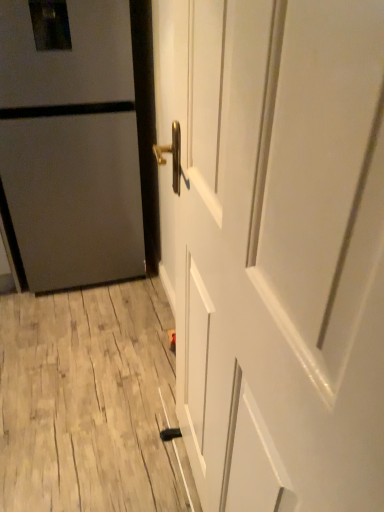
Question: From a real-world perspective, is white glossy door at center, marked as the second door in a left-to-right arrangement, physically located above or below matte gray door at left, arranged as the 2th door when viewed from the right?

Choices:
 (A) below
 (B) above

Answer: (B)

Question: Based on their sizes in the image, would you say white glossy door at center, which ranks as the first door in front-to-back order, is bigger or smaller than matte gray door at left, arranged as the 2th door when viewed from the right?

Choices:
 (A) small
 (B) big

Answer: (A)

Question: Based on their positions, is white glossy door at center, which ranks as the first door in front-to-back order, located to the left or right of matte gray door at left, marked as the 1th door in a back-to-front arrangement?

Choices:
 (A) right
 (B) left

Answer: (A)

Question: Considering the positions of matte gray door at left, which appears as the second door when viewed from the front, and white glossy door at center, marked as the second door in a left-to-right arrangement, in the image, is matte gray door at left, which appears as the second door when viewed from the front, wider or thinner than white glossy door at center, marked as the second door in a left-to-right arrangement,?

Choices:
 (A) wide
 (B) thin

Answer: (A)

Question: From a real-world perspective, is matte gray door at left, which appears as the second door when viewed from the front, above or below white glossy door at center, marked as the first door in a right-to-left arrangement?

Choices:
 (A) below
 (B) above

Answer: (A)

Question: Is matte gray door at left, arranged as the 2th door when viewed from the right, spatially inside white glossy door at center, which ranks as the first door in front-to-back order, or outside of it?

Choices:
 (A) inside
 (B) outside

Answer: (B)

Question: From their relative heights in the image, would you say matte gray door at left, arranged as the 2th door when viewed from the right, is taller or shorter than white glossy door at center, marked as the first door in a right-to-left arrangement?

Choices:
 (A) tall
 (B) short

Answer: (B)